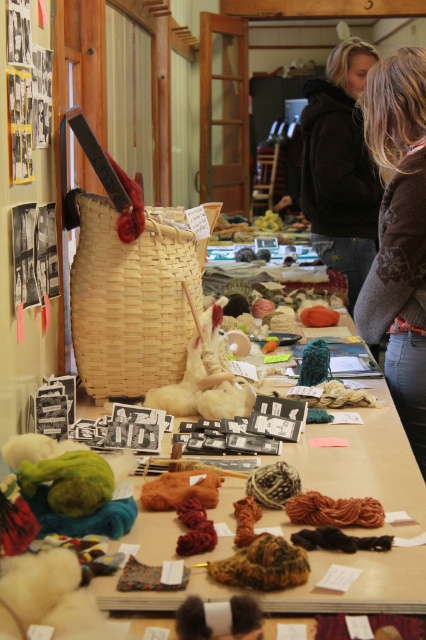
You are organizing a craft fair booth and need to place a new display item between the woven basket at center and the brown fuzzy sweater at upper right. Based on their positions, where should you place the new item to ensure it is between them?

The woven basket at center is below the brown fuzzy sweater at upper right, so placing the new item between them would require positioning it above the woven basket at center and below the brown fuzzy sweater at upper right.

You are standing in the workshop and want to pick up an item from the table. The item you want is located at point (x=311, y=556). There is another item at point (x=420, y=198). Which item is closer to you?

The item at point (x=311, y=556) is closer to you than the item at point (x=420, y=198).

You are organizing a craft fair booth and need to place a new display item between the woven straw basket at center and the brown fuzzy sweater at upper right. Based on their positions, which object should the new item be placed closer to?

The woven straw basket at center is in front of the brown fuzzy sweater at upper right, so the new item should be placed closer to the brown fuzzy sweater at upper right to maintain the spatial arrangement.